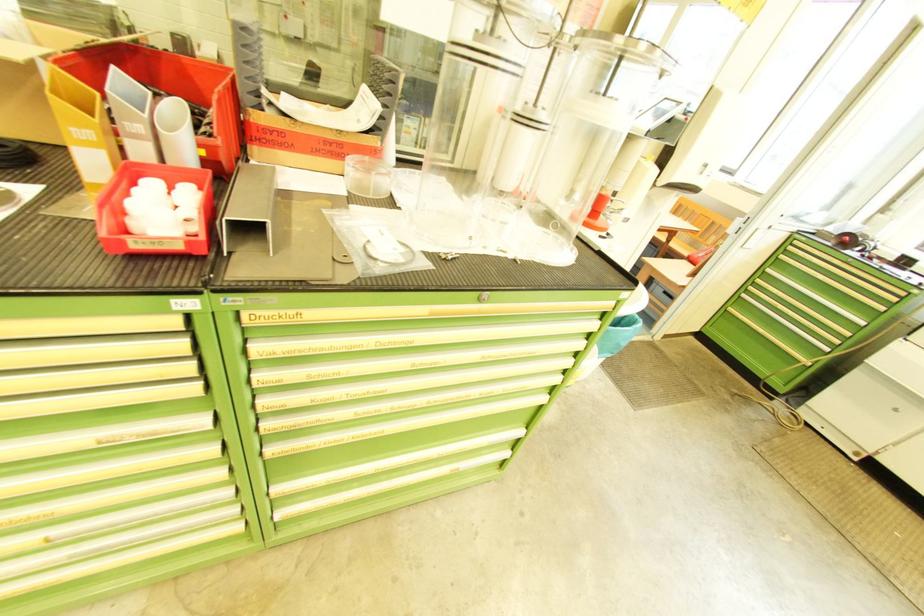
Where would you sit the chair sitting surface? Please return your answer as a coordinate pair (x, y).

(688, 241)